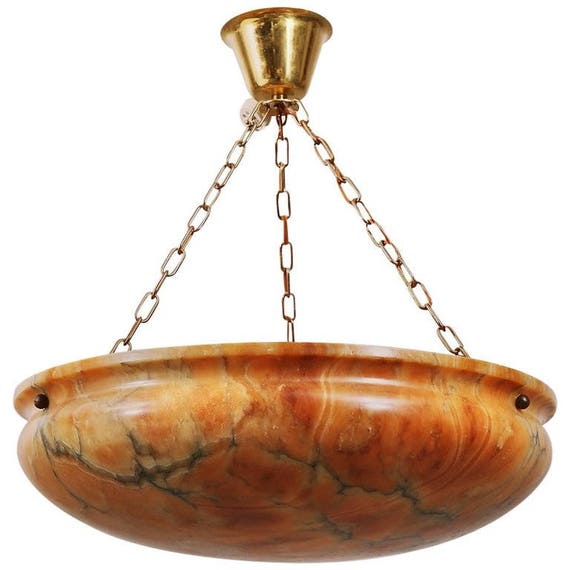
Identify the location of old circular ceiling mount for planter, top center. The width and height of the screenshot is (570, 570). (256, 23), (283, 52), (298, 44), (443, 548), (450, 396).